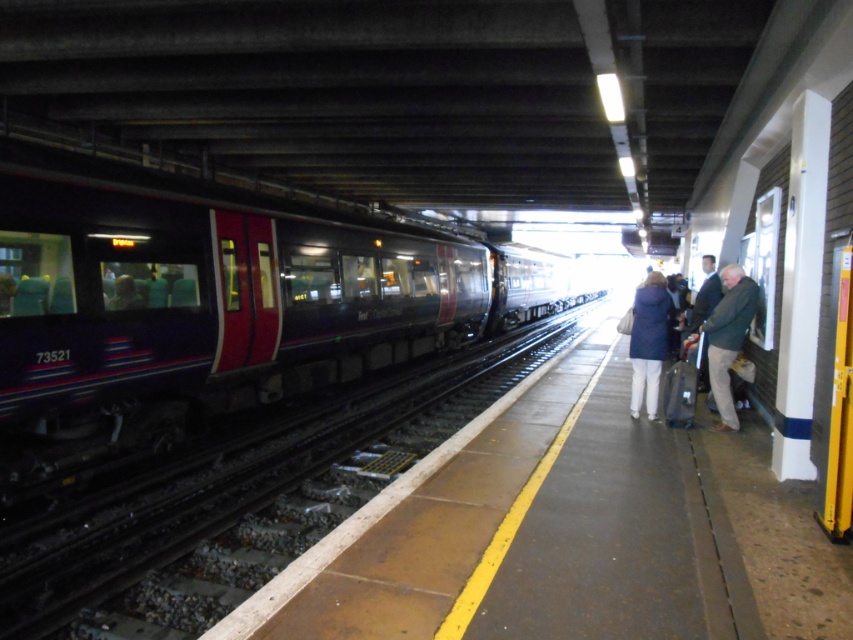
Can you confirm if metallic train track at center is bigger than dark green jacket at right?

Yes, metallic train track at center is bigger than dark green jacket at right.

Is point (416, 388) more distant than point (724, 280)?

Yes, point (416, 388) is farther from viewer.

Is point (305, 474) positioned after point (730, 342)?

Yes, point (305, 474) is farther from viewer.

Find the location of a particular element. This screenshot has width=853, height=640. metallic train track at center is located at coordinates pyautogui.click(x=242, y=500).

Which is above, metallic train track at center or matte blue coat at right?

matte blue coat at right is higher up.

Does metallic train track at center appear over matte blue coat at right?

No, metallic train track at center is not above matte blue coat at right.

Where is `metallic train track at center`? The height and width of the screenshot is (640, 853). metallic train track at center is located at coordinates (242, 500).

Does metallic blue train at center come in front of metallic train track at center?

No, metallic blue train at center is further to the viewer.

Between metallic blue train at center and metallic train track at center, which one has less height?

metallic train track at center is shorter.

At what (x,y) coordinates should I click in order to perform the action: click on metallic blue train at center. Please return your answer as a coordinate pair (x, y). Looking at the image, I should click on (210, 301).